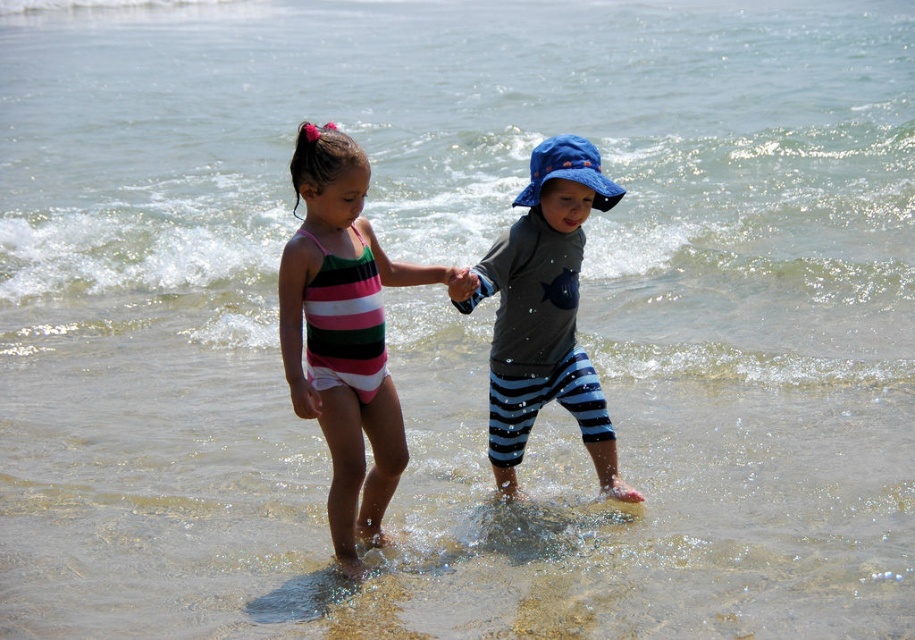
Question: Is striped fabric swimsuit at center to the right of blue cotton hat at center from the viewer's perspective?

Choices:
 (A) no
 (B) yes

Answer: (A)

Question: Which of the following is the farthest from the observer?

Choices:
 (A) (599, 198)
 (B) (366, 307)

Answer: (A)

Question: Can you confirm if striped fabric swimsuit at center is thinner than blue cotton hat at center?

Choices:
 (A) yes
 (B) no

Answer: (A)

Question: Estimate the real-world distances between objects in this image. Which object is farther from the striped fabric swimsuit at center?

Choices:
 (A) smooth skin hand at center
 (B) blue cotton hat at center

Answer: (B)

Question: Does striped fabric swimsuit at center appear over smooth skin hand at center?

Choices:
 (A) yes
 (B) no

Answer: (B)

Question: Which of the following is the closest to the observer?

Choices:
 (A) smooth skin hand at center
 (B) blue cotton hat at center
 (C) striped fabric swimsuit at center

Answer: (C)